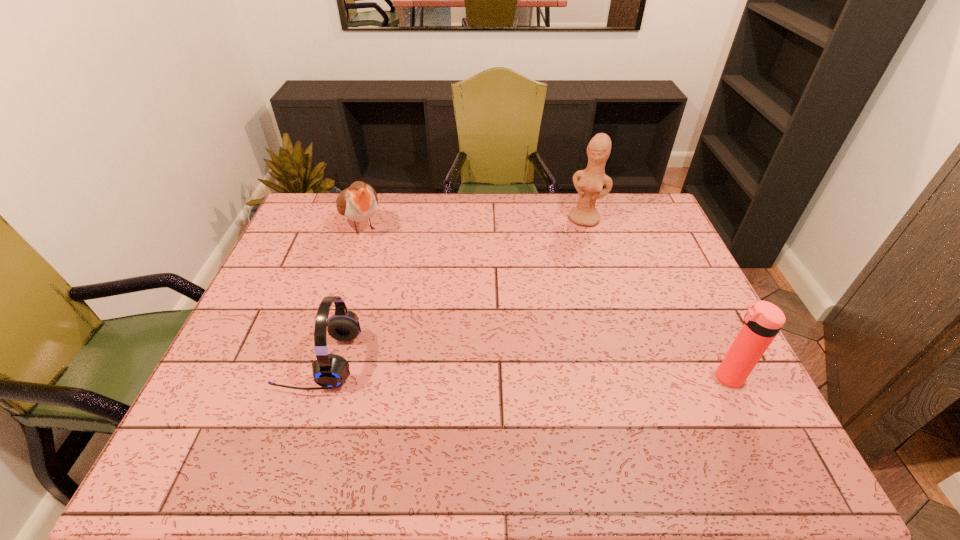
Locate an element on the screen. This screenshot has height=540, width=960. vacant space on the desktop that is between the headset and the rightmost object and is positioned on the front-facing side of the third object from left to right is located at coordinates (513, 368).

Find the location of a particular element. This screenshot has width=960, height=540. vacant space on the desktop that is between the headset and the thermos bottle and is positioned at the face of the bird is located at coordinates (462, 366).